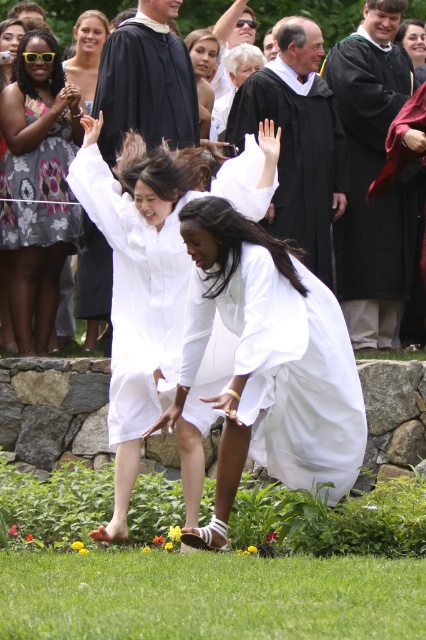
Question: Is white matte graduation gown at center bigger than matte black graduation gown at upper center?

Choices:
 (A) no
 (B) yes

Answer: (B)

Question: Estimate the real-world distances between objects in this image. Which object is farther from the matte black robe at center?

Choices:
 (A) matte black graduation gown at upper center
 (B) white satin dress at center

Answer: (B)

Question: Which of the following is the farthest from the observer?

Choices:
 (A) (36, 44)
 (B) (173, 65)
 (C) (77, 65)
 (D) (264, 266)

Answer: (C)

Question: Is green grass at lower center positioned in front of floral-patterned fabric dress at upper left?

Choices:
 (A) no
 (B) yes

Answer: (B)

Question: Where is white matte graduation gown at center located in relation to matte black dress at upper left in the image?

Choices:
 (A) left
 (B) right

Answer: (B)

Question: Among these points, which one is farthest from the camera?

Choices:
 (A) (304, 296)
 (B) (25, 173)
 (C) (371, 596)

Answer: (B)